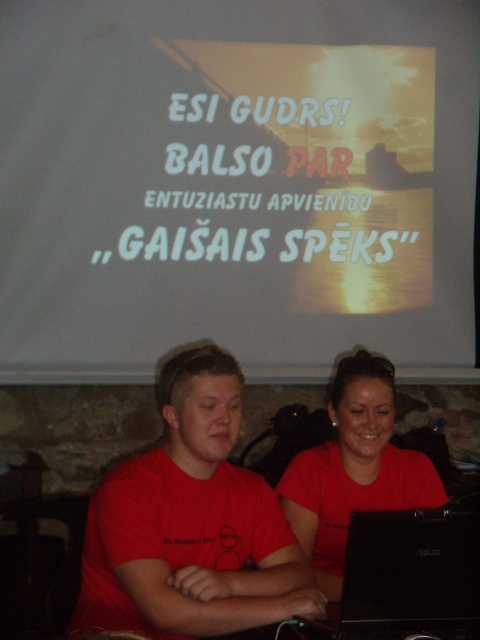
Question: Is white paper at upper center thinner than matte red t-shirt at center?

Choices:
 (A) no
 (B) yes

Answer: (A)

Question: Which point is farther from the camera taking this photo?

Choices:
 (A) pyautogui.click(x=321, y=333)
 (B) pyautogui.click(x=200, y=444)

Answer: (A)

Question: Can you confirm if matte red shirt at center is smaller than black matte laptop at center?

Choices:
 (A) no
 (B) yes

Answer: (A)

Question: Which point is farther from the camera taking this photo?

Choices:
 (A) (x=327, y=467)
 (B) (x=409, y=579)
 (C) (x=12, y=339)

Answer: (C)

Question: Considering the relative positions of matte red t-shirt at center and black matte laptop at center in the image provided, where is matte red t-shirt at center located with respect to black matte laptop at center?

Choices:
 (A) below
 (B) above

Answer: (B)

Question: Based on their relative distances, which object is farther from the white paper at upper center?

Choices:
 (A) matte red t-shirt at center
 (B) black matte laptop at center

Answer: (B)